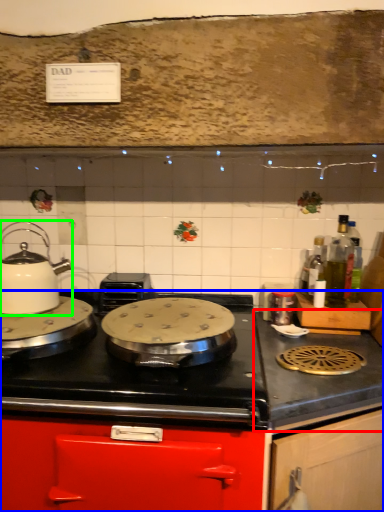
Question: Estimate the real-world distances between objects in this image. Which object is farther from counter top (highlighted by a red box), cabinetry (highlighted by a blue box) or kitchen appliance (highlighted by a green box)?

Choices:
 (A) cabinetry
 (B) kitchen appliance

Answer: (B)